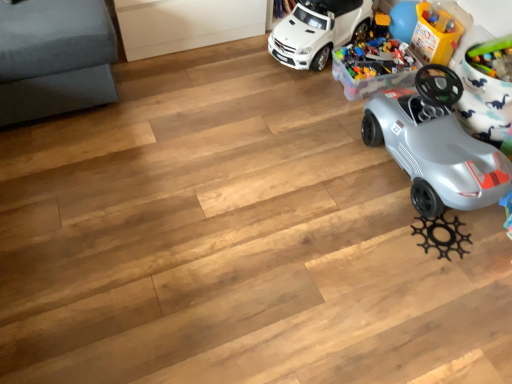
Question: From the image's perspective, is translucent plastic toy at upper right, the 2th toy in the left-to-right sequence, located above or below translucent plastic container at upper right, marked as the second toy in a right-to-left arrangement?

Choices:
 (A) below
 (B) above

Answer: (B)

Question: From a real-world perspective, is translucent plastic toy at upper right, the 2th toy in the left-to-right sequence, physically located above or below translucent plastic container at upper right, marked as the second toy in a right-to-left arrangement?

Choices:
 (A) above
 (B) below

Answer: (A)

Question: Estimate the real-world distances between objects in this image. Which object is farther from the silver metallic car at right, which appears as the 2th car when viewed from the top?

Choices:
 (A) white matte toy car at upper center, the 1th car in the top-to-bottom sequence
 (B) translucent plastic container at upper right, the 1th toy in the left-to-right sequence
 (C) translucent plastic toy at upper right, the 2th toy in the left-to-right sequence

Answer: (A)

Question: Estimate the real-world distances between objects in this image. Which object is farther from the silver metallic car at right, positioned as the 1th car in bottom-to-top order?

Choices:
 (A) translucent plastic container at upper right, the 1th toy in the left-to-right sequence
 (B) translucent plastic toy at upper right, positioned as the 1th toy in right-to-left order
 (C) white matte toy car at upper center, which is the 2th car in bottom-to-top order

Answer: (C)